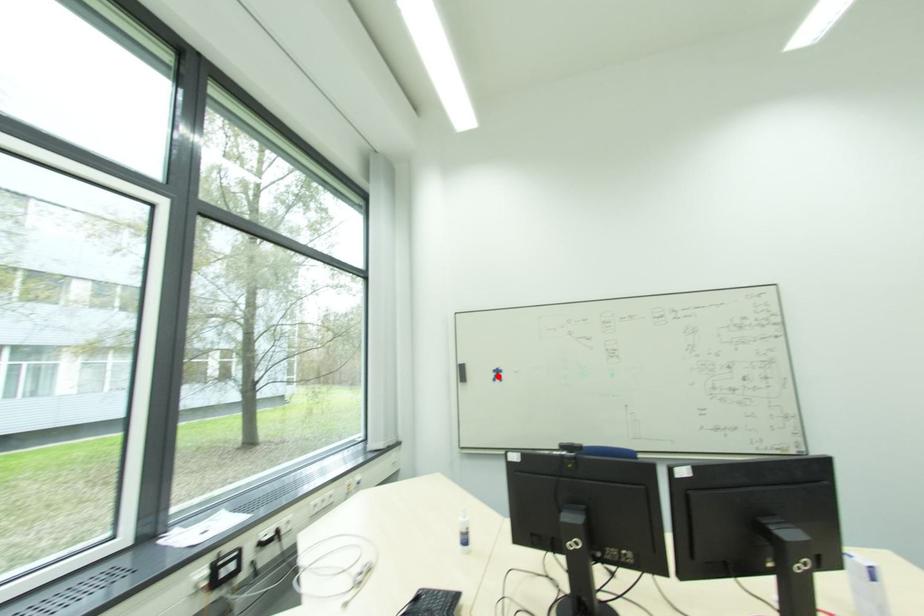
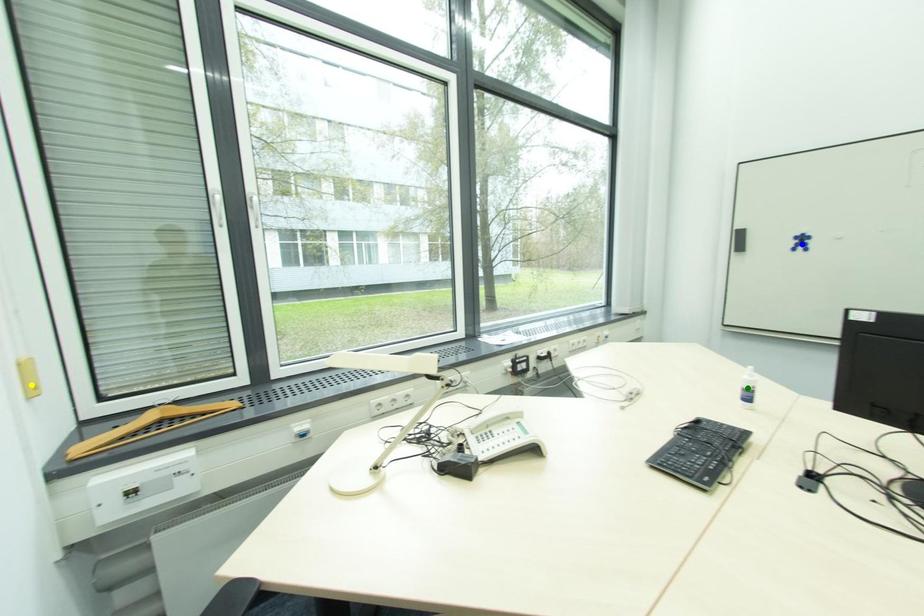
Question: I am providing you with two images of the same scene from different viewpoints. A red point is marked on the first image. You are given multiple points on the second image. In image 2, which mark is for the same physical point as the one in image 1?

Choices:
 (A) yellow point
 (B) blue point
 (C) green point

Answer: (B)